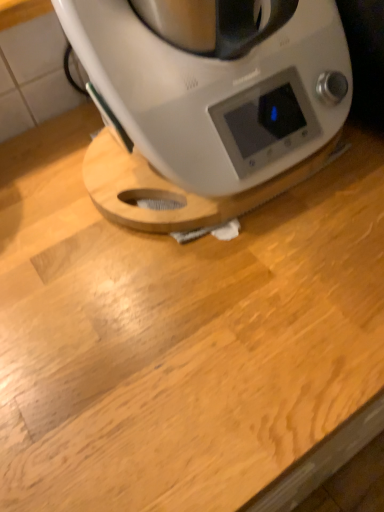
Locate an element on the screen. The image size is (384, 512). white plastic appliance at center is located at coordinates (215, 83).

Describe the element at coordinates (215, 83) in the screenshot. I see `white plastic appliance at center` at that location.

This screenshot has width=384, height=512. Find the location of `white plastic appliance at center`. white plastic appliance at center is located at coordinates (215, 83).